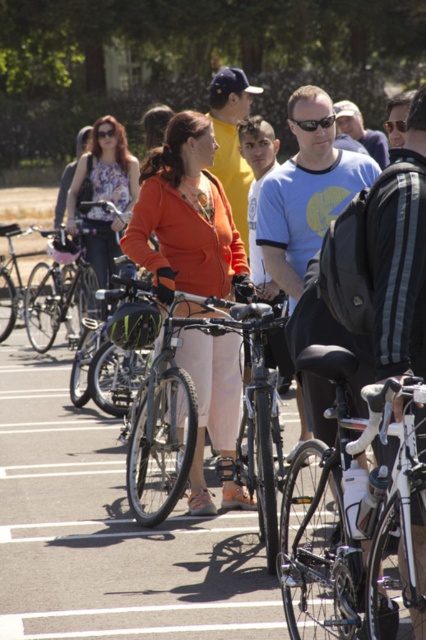
Can you confirm if shiny silver bicycle at center is smaller than shiny black bicycle at center?

Correct, shiny silver bicycle at center occupies less space than shiny black bicycle at center.

Between shiny silver bicycle at center and shiny black bicycle at center, which one appears on the left side from the viewer's perspective?

From the viewer's perspective, shiny black bicycle at center appears more on the left side.

I want to click on shiny silver bicycle at center, so click(x=348, y=513).

Which is below, shiny silver bicycle at center or green matte helmet at center?

Positioned lower is shiny silver bicycle at center.

Can you confirm if shiny silver bicycle at center is wider than green matte helmet at center?

Correct, the width of shiny silver bicycle at center exceeds that of green matte helmet at center.

Is point (367, 408) closer to camera compared to point (118, 332)?

That is True.

Where is `shiny silver bicycle at center`? This screenshot has height=640, width=426. shiny silver bicycle at center is located at coordinates (348, 513).

Which of these two, shiny black bicycle at center or green matte helmet at center, stands shorter?

Standing shorter between the two is green matte helmet at center.

Can you confirm if shiny black bicycle at center is positioned to the right of green matte helmet at center?

Indeed, shiny black bicycle at center is positioned on the right side of green matte helmet at center.

Does point (143, 282) come in front of point (118, 326)?

No.

Where is `shiny black bicycle at center`? The width and height of the screenshot is (426, 640). shiny black bicycle at center is located at coordinates (198, 419).